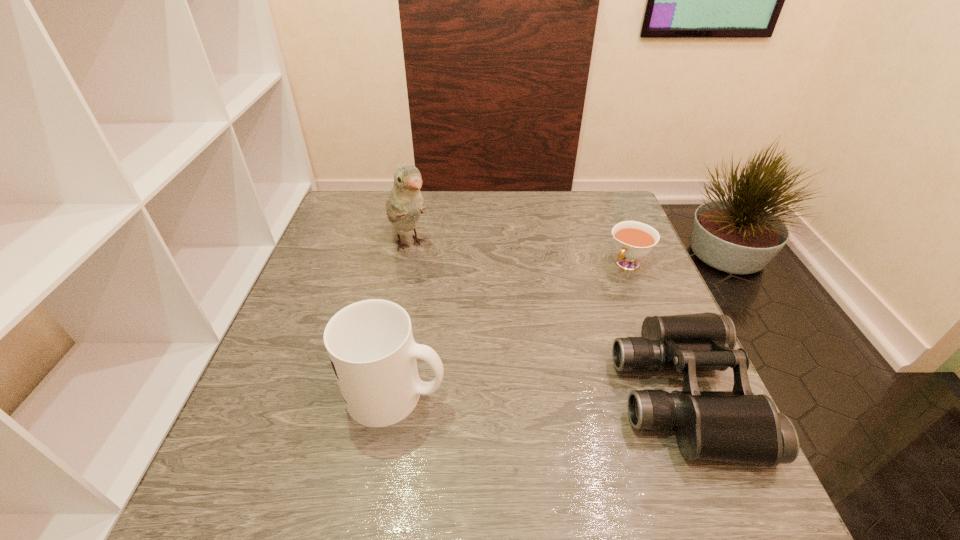
This screenshot has height=540, width=960. I want to click on vacant space on the desktop that is between the mug and the third tallest object and is positioned on the side of the shortest object with the handle, so click(509, 394).

I want to click on free spot on the desktop that is between the second tallest object and the binoculars and is positioned at the face of the bird, so click(525, 394).